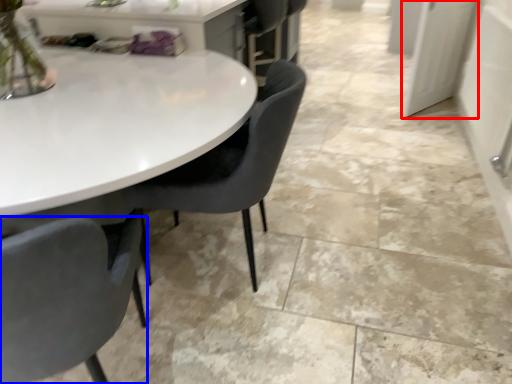
Question: Which of the following is the farthest to the observer, glass door (highlighted by a red box) or chair (highlighted by a blue box)?

Choices:
 (A) glass door
 (B) chair

Answer: (A)